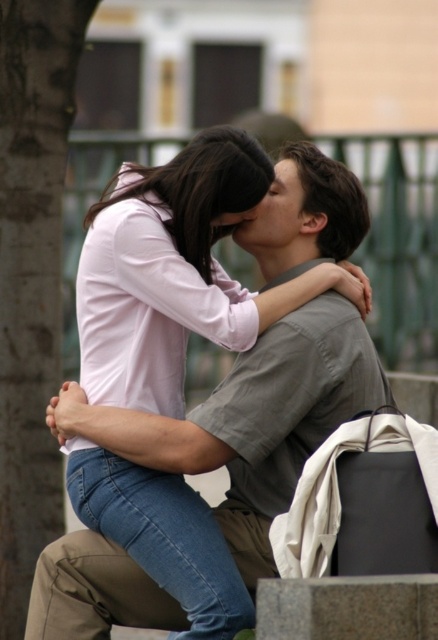
You are a photographer trying to capture the matte pink shirt at center and the brown rough tree trunk at left in a single frame. Considering their sizes, which object should you focus on to ensure both are clearly visible in the photo?

The matte pink shirt at center is larger than the brown rough tree trunk at left, so you should focus on the matte pink shirt at center to ensure both are clearly visible in the photo.

You are standing in a park and see the matte pink shirt at center and the brown rough tree trunk at left. Which object is positioned more to the right side of the scene?

The matte pink shirt at center is positioned more to the right side of the scene than the brown rough tree trunk at left.